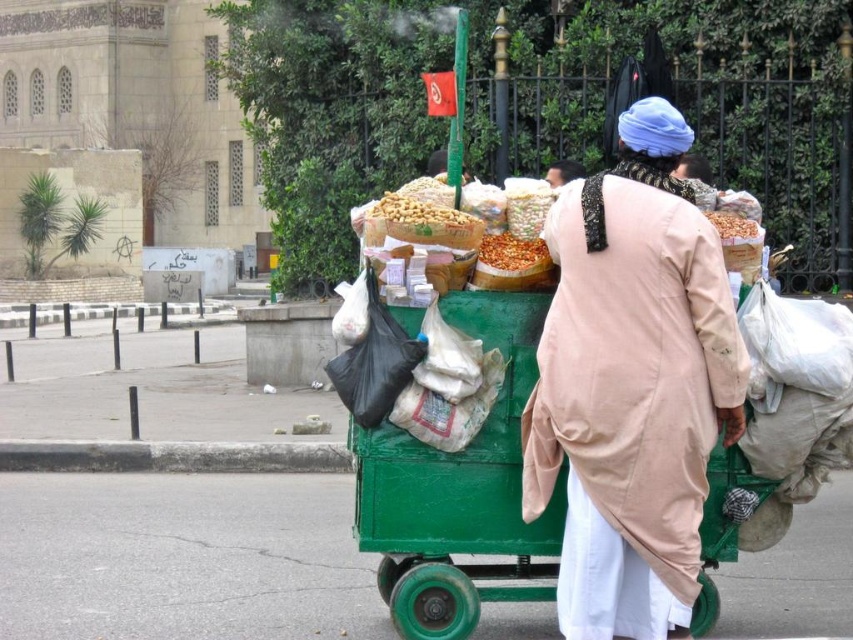
You are a customer looking at the vendor pushing a green cart. Where are the smooth brown nuts at center located on the cart?

The smooth brown nuts at center are located at the 2D coordinates point (419,212) on the cart.

You are a customer at the market and see the beige cotton robe at center and the crumbly brown bread at center. Which item is positioned to the right of the other?

The beige cotton robe at center is to the right of crumbly brown bread at center.